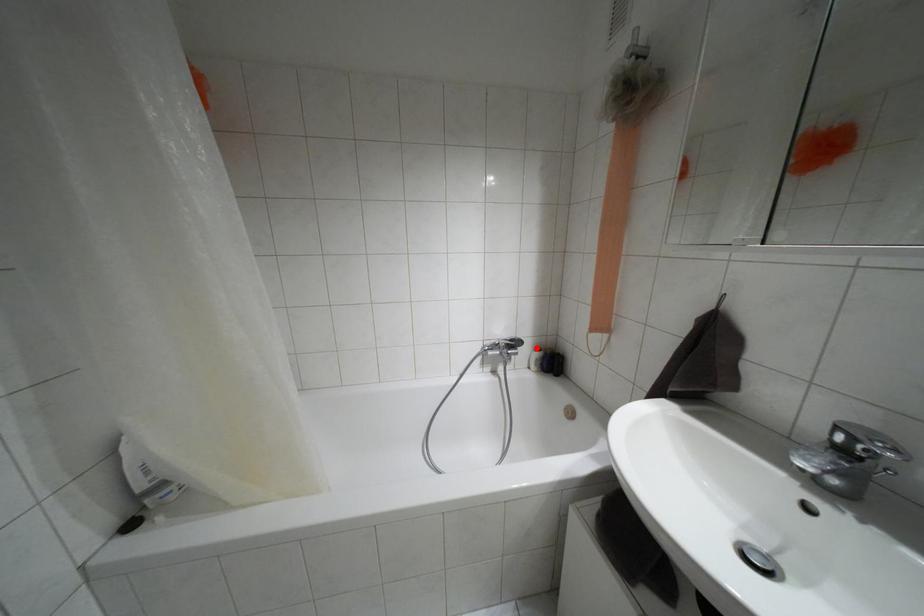
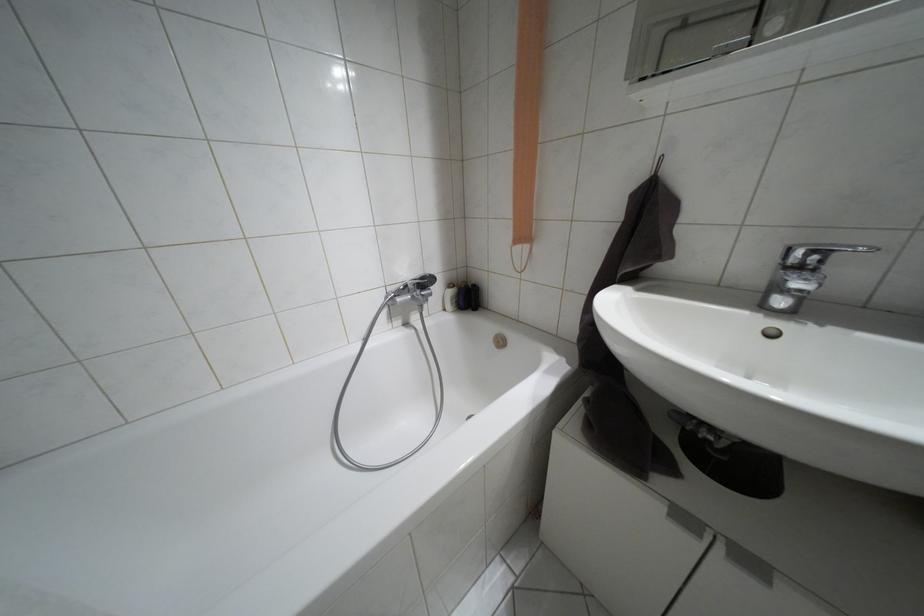
Where in the second image is the point corresponding to the highlighted location from the first image?

(448, 285)